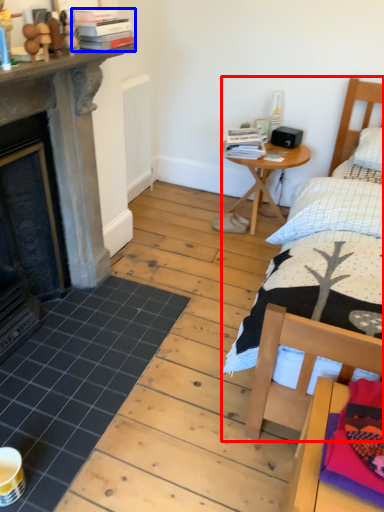
Question: Which point is further to the camera, bed (highlighted by a red box) or book (highlighted by a blue box)?

Choices:
 (A) bed
 (B) book

Answer: (B)